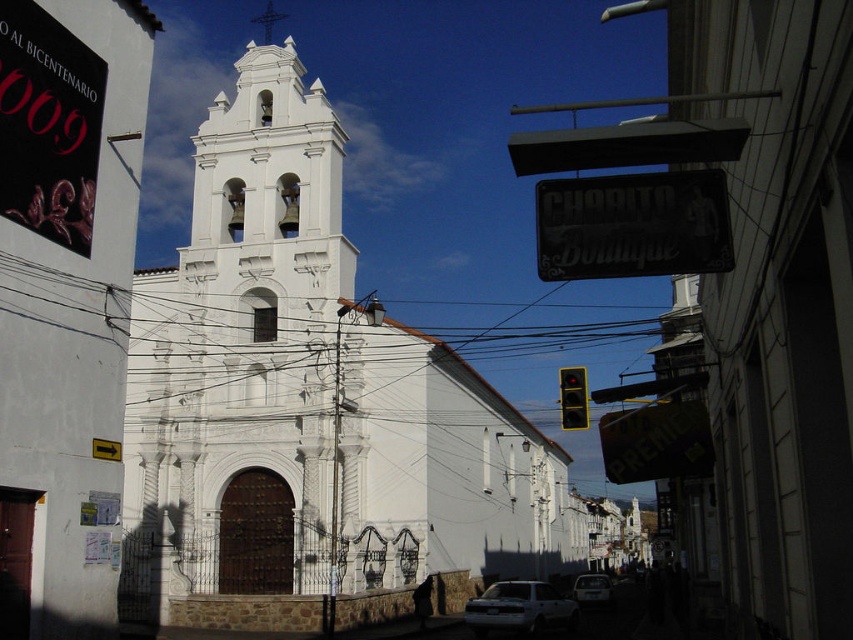
You are a delivery driver who needs to park your vehicle in this street scene. You see the black metal sign at upper center and the white matte car at lower center. Which object is positioned higher in the image?

The black metal sign at upper center is positioned higher in the image than the white matte car at lower center.

You are driving a white matte car at lower center and want to park it next to the yellow matte traffic light at center. Can the car fit in the space next to the traffic light without overlapping it?

The white matte car at lower center is narrower than the yellow matte traffic light at center, so it can fit in the space next to the traffic light without overlapping it.

You are standing on the street in front of the white church with a bell tower. You see two points marked in the image. The first point is at coordinate [576,214] and the second point is at coordinate [560,608]. Which point is closer to you?

The point at coordinate [576,214] is closer to you than the point at coordinate [560,608].